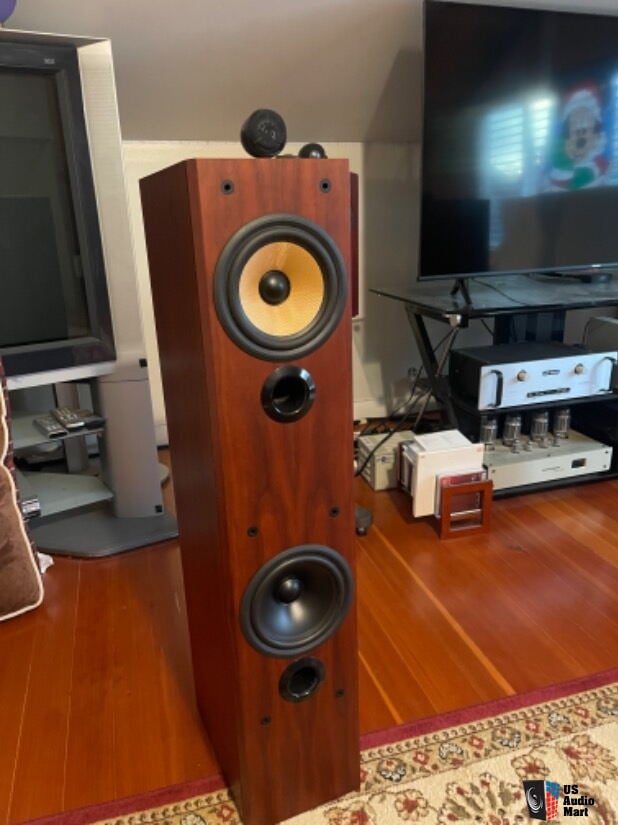
Locate an element on the screen. rug is located at coordinates (460, 799).